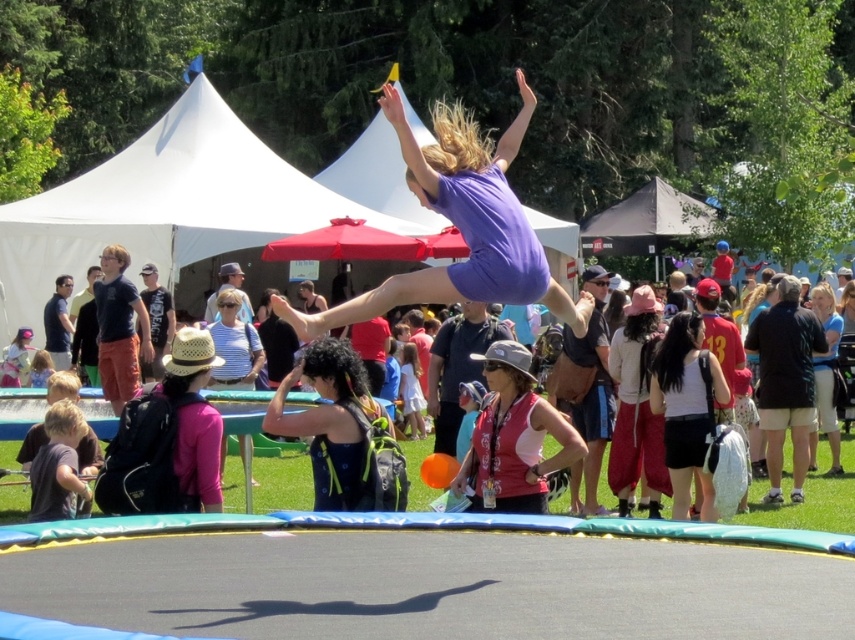
Question: Which point is closer to the camera?

Choices:
 (A) (325, 412)
 (B) (534, 508)
 (C) (3, 428)
 (D) (703, 456)

Answer: (A)

Question: Does matte purple shorts at center come behind pink fabric hat at center?

Choices:
 (A) no
 (B) yes

Answer: (A)

Question: Does matte purple shorts at center have a lesser width compared to white matte shorts at center?

Choices:
 (A) no
 (B) yes

Answer: (A)

Question: Which point is farther to the camera?

Choices:
 (A) matte pink tank top at center
 (B) matte purple shorts at center
 (C) dark blue fabric backpack at center
 (D) light blue shirt at upper right

Answer: (D)

Question: Which object appears farthest from the camera in this image?

Choices:
 (A) pink fabric hat at center
 (B) white matte shorts at center

Answer: (A)

Question: In this image, where is white matte shorts at center located relative to pink fabric hat at center?

Choices:
 (A) left
 (B) right

Answer: (B)